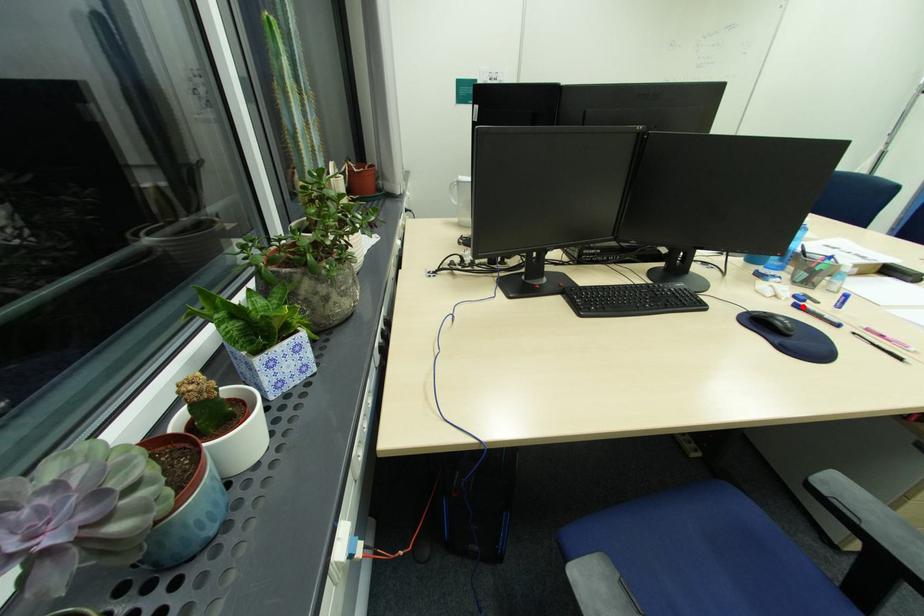
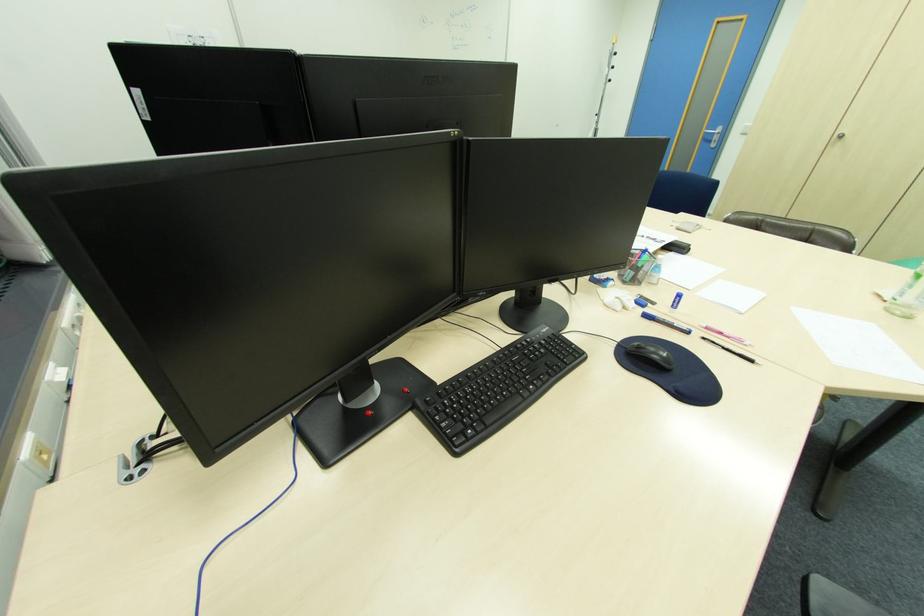
Where in the second image is the point corresponding to the highlighted location from the first image?

(651, 315)